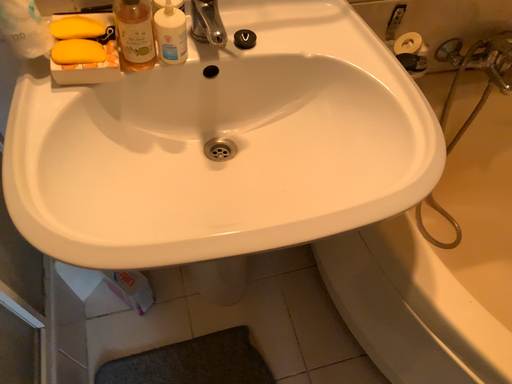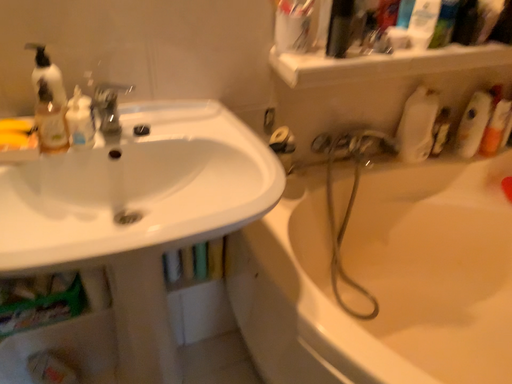
Question: How did the camera likely rotate when shooting the video?

Choices:
 (A) rotated downward
 (B) rotated upward

Answer: (B)